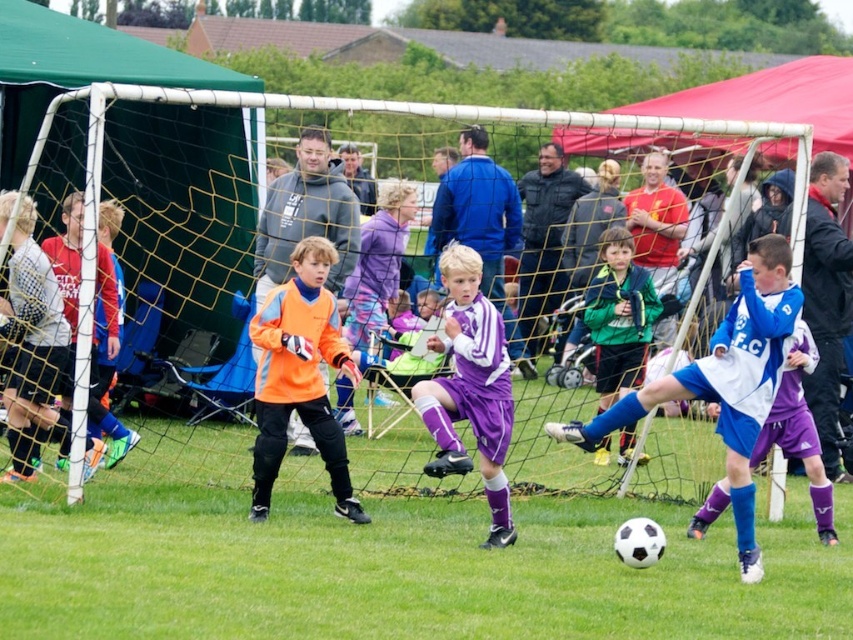
Who is more distant from viewer, (761, 323) or (273, 428)?

The point (273, 428) is behind.

Between blue jersey at center and orange matte jersey at center, which one appears on the right side from the viewer's perspective?

blue jersey at center

Which is in front, point (675, 387) or point (293, 305)?

Point (675, 387)

Where is `blue jersey at center`? The height and width of the screenshot is (640, 853). blue jersey at center is located at coordinates (724, 380).

This screenshot has height=640, width=853. Describe the element at coordinates (396, 113) in the screenshot. I see `yellow mesh net at center` at that location.

Can you confirm if yellow mesh net at center is positioned below orange matte jersey at center?

Incorrect, yellow mesh net at center is not positioned below orange matte jersey at center.

Which is behind, point (80, 374) or point (303, 385)?

The point (303, 385) is more distant.

Locate an element on the screen. This screenshot has height=640, width=853. yellow mesh net at center is located at coordinates (396, 113).

Looking at this image, is blue jersey at center taller than purple matte soccer uniform at center?

Yes, blue jersey at center is taller than purple matte soccer uniform at center.

Is point (583, 440) positioned before point (469, 410)?

That is True.

Find the location of a particular element. The image size is (853, 640). blue jersey at center is located at coordinates pyautogui.click(x=724, y=380).